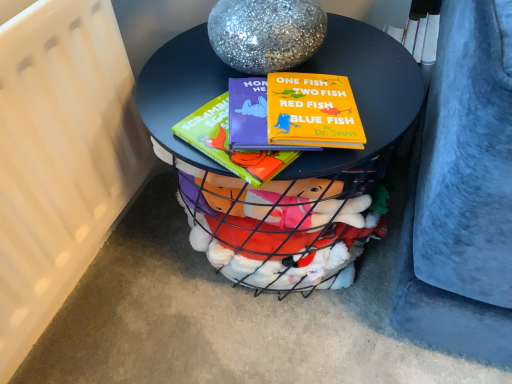
Locate an element on the screen. Image resolution: width=512 pixels, height=384 pixels. vacant space situated above matte black table at center (from a real-world perspective) is located at coordinates (260, 86).